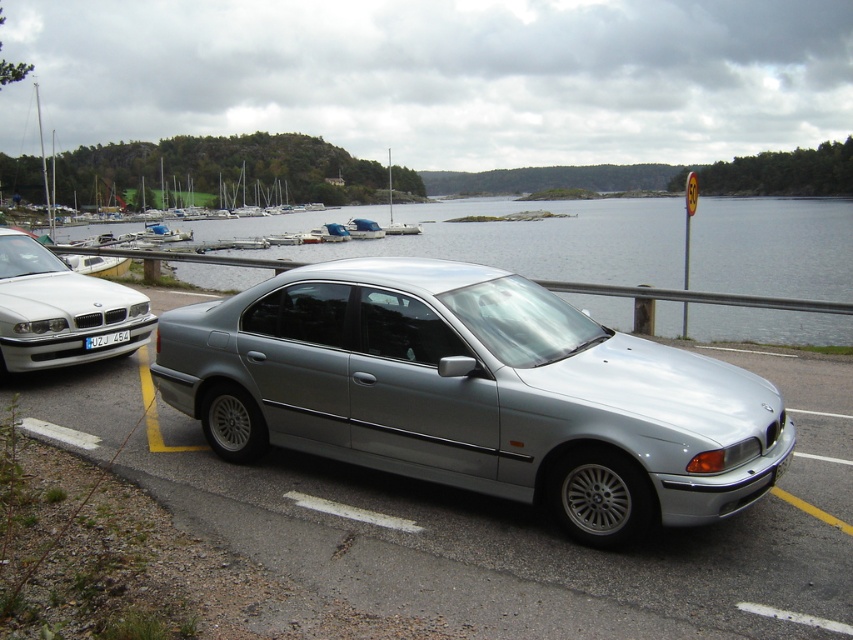
Which of these two, silver metallic water at center or white glossy boat at center, stands taller?

silver metallic water at center is taller.

The image size is (853, 640). What do you see at coordinates (532, 240) in the screenshot?
I see `silver metallic water at center` at bounding box center [532, 240].

Who is more forward, (552,264) or (378,236)?

Point (552,264)

Locate an element on the screen. silver metallic water at center is located at coordinates (532, 240).

Who is more forward, (735,428) or (349,220)?

Point (735,428) is more forward.

Is point (688, 428) positioned before point (376, 225)?

Yes, point (688, 428) is closer to viewer.

Where is `satin silver car at center`? satin silver car at center is located at coordinates (474, 394).

Between point (68, 355) and point (351, 237), which one is positioned behind?

The point (351, 237) is behind.

Is point (59, 268) in front of point (370, 234)?

Yes, point (59, 268) is in front of point (370, 234).

Find the location of a particular element. silver metallic sedan at left is located at coordinates (59, 308).